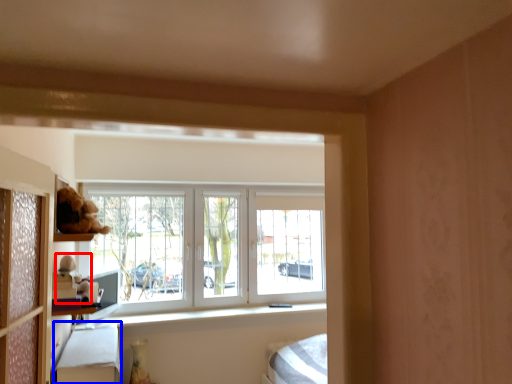
Question: Which object is further to the camera taking this photo, toy (highlighted by a red box) or bed frame (highlighted by a blue box)?

Choices:
 (A) toy
 (B) bed frame

Answer: (A)